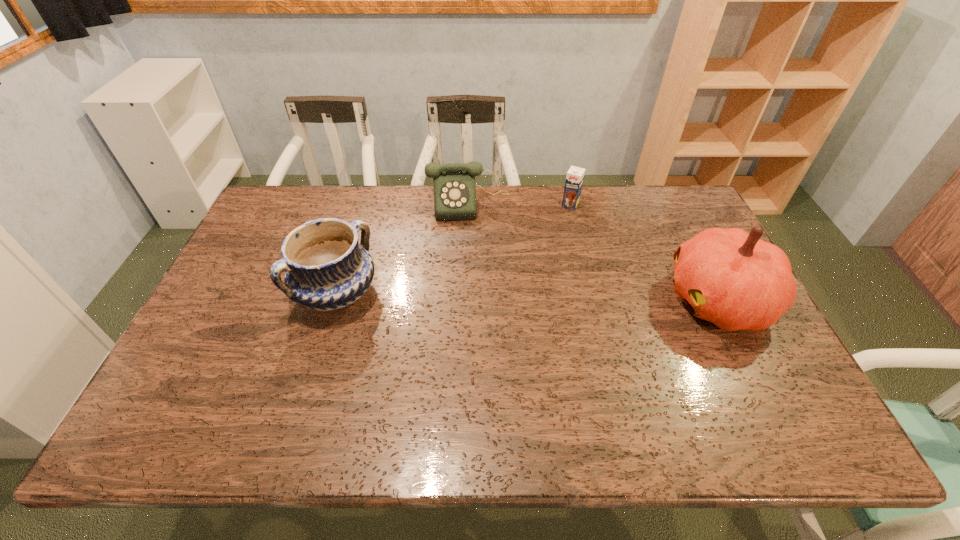
The image size is (960, 540). Find the location of `blank space at the near edge of the desktop`. blank space at the near edge of the desktop is located at coordinates (441, 376).

Locate an element on the screen. The height and width of the screenshot is (540, 960). free space at the left edge of the desktop is located at coordinates (256, 268).

The image size is (960, 540). In the image, there is a desktop. Find the location of `vacant region at the right edge`. vacant region at the right edge is located at coordinates (771, 359).

Where is `free area in between the pumpkin and the pottery`? The height and width of the screenshot is (540, 960). free area in between the pumpkin and the pottery is located at coordinates (528, 297).

I want to click on vacant space that's between the tallest object and the third object from right to left, so click(593, 252).

Find the location of a particular element. empty space that is in between the third shortest object and the telephone is located at coordinates (403, 248).

Find the location of a particular element. free space between the leftmost object and the second object from right to left is located at coordinates (454, 249).

Where is `free spot between the second object from left to right and the tallest object`? This screenshot has width=960, height=540. free spot between the second object from left to right and the tallest object is located at coordinates (593, 252).

You are a GUI agent. You are given a task and a screenshot of the screen. Output one action in this format:
    pyautogui.click(x=<x>, y=<y>)
    Task: Click on the unoccupied position between the pottery and the rightmost object
    
    Given the screenshot: What is the action you would take?
    pyautogui.click(x=528, y=297)

Find the location of a particular element. free space that is in between the chocolate milk and the pumpkin is located at coordinates tap(644, 252).